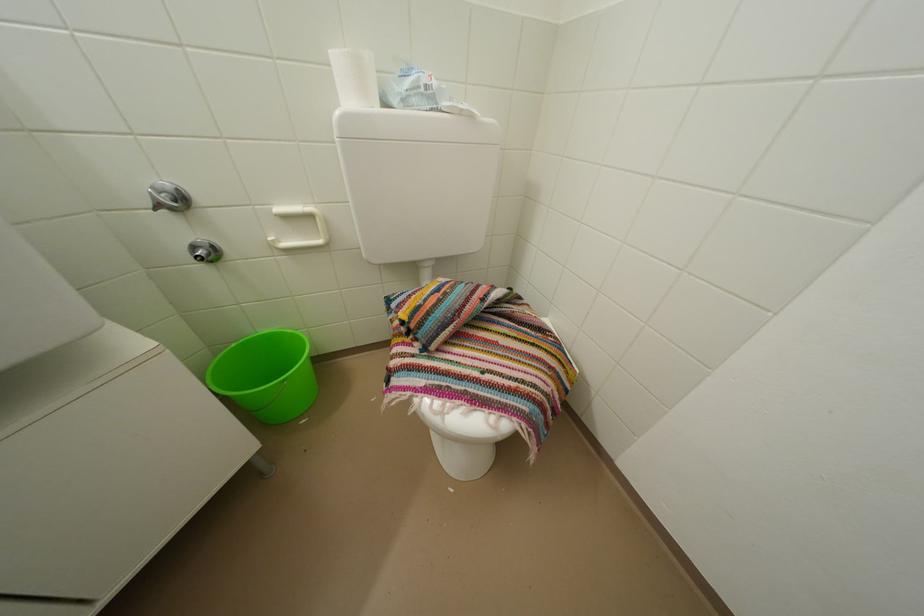
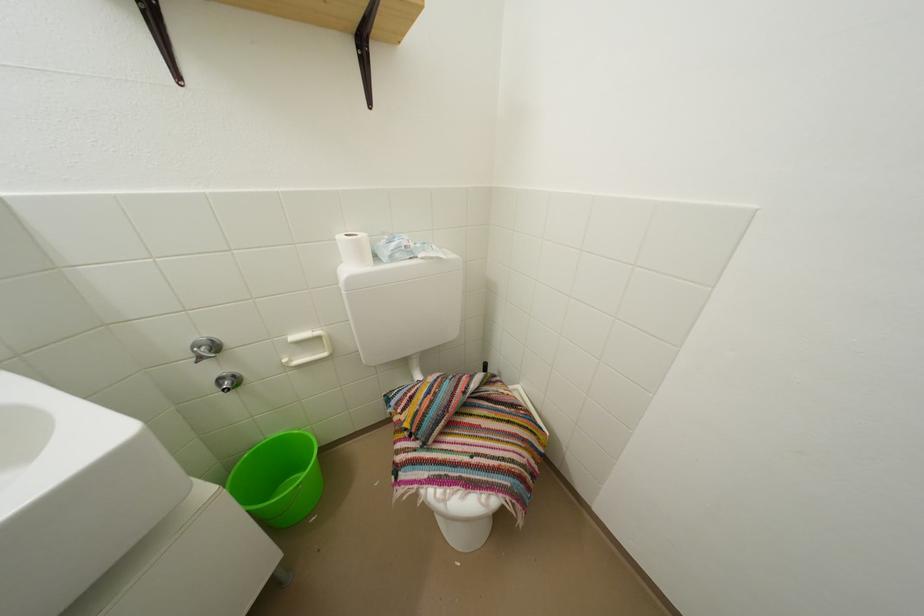
Locate, in the second image, the point that corresponds to (x=294, y=386) in the first image.

(309, 491)